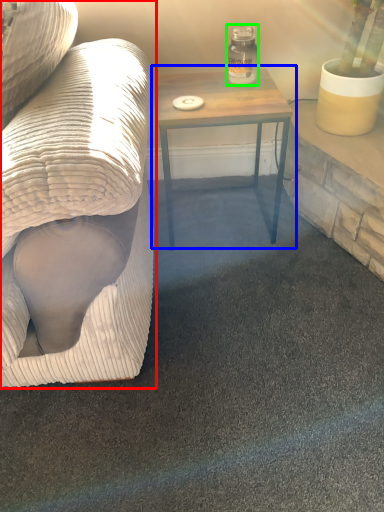
Question: Which is farther away from studio couch (highlighted by a red box)? table (highlighted by a blue box) or glass jar (highlighted by a green box)?

Choices:
 (A) table
 (B) glass jar

Answer: (B)